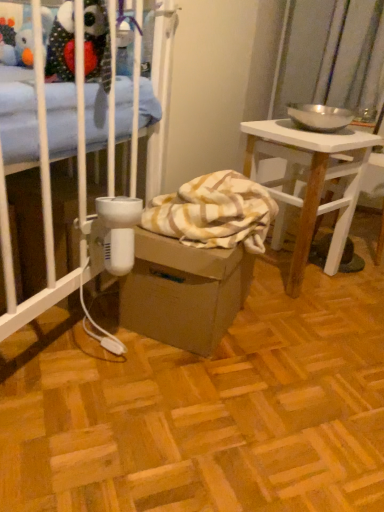
Question: From a real-world perspective, is brown cardboard box at center physically above white wood desk at right?

Choices:
 (A) yes
 (B) no

Answer: (B)

Question: Considering the relative positions of brown cardboard box at center and white wood desk at right in the image provided, is brown cardboard box at center to the right of white wood desk at right from the viewer's perspective?

Choices:
 (A) no
 (B) yes

Answer: (A)

Question: Considering the relative sizes of brown cardboard box at center and white wood desk at right in the image provided, is brown cardboard box at center bigger than white wood desk at right?

Choices:
 (A) no
 (B) yes

Answer: (A)

Question: Is brown cardboard box at center not close to white wood desk at right?

Choices:
 (A) no
 (B) yes

Answer: (A)

Question: Considering the relative positions of brown cardboard box at center and white wood desk at right in the image provided, is brown cardboard box at center to the left of white wood desk at right from the viewer's perspective?

Choices:
 (A) yes
 (B) no

Answer: (A)

Question: Is brown cardboard box at center oriented away from white wood desk at right?

Choices:
 (A) no
 (B) yes

Answer: (A)

Question: Is white wood desk at right aimed at brown cardboard box at center?

Choices:
 (A) no
 (B) yes

Answer: (A)

Question: From a real-world perspective, is white wood desk at right positioned over brown cardboard box at center based on gravity?

Choices:
 (A) no
 (B) yes

Answer: (B)

Question: Is white wood desk at right at the left side of brown cardboard box at center?

Choices:
 (A) no
 (B) yes

Answer: (A)

Question: Is white wood desk at right behind brown cardboard box at center?

Choices:
 (A) no
 (B) yes

Answer: (B)

Question: From the image's perspective, is white wood desk at right on top of brown cardboard box at center?

Choices:
 (A) no
 (B) yes

Answer: (B)

Question: Is white wood desk at right to the right of brown cardboard box at center from the viewer's perspective?

Choices:
 (A) no
 (B) yes

Answer: (B)

Question: In the image, is brown cardboard box at center positioned in front of or behind white wood desk at right?

Choices:
 (A) behind
 (B) front

Answer: (B)